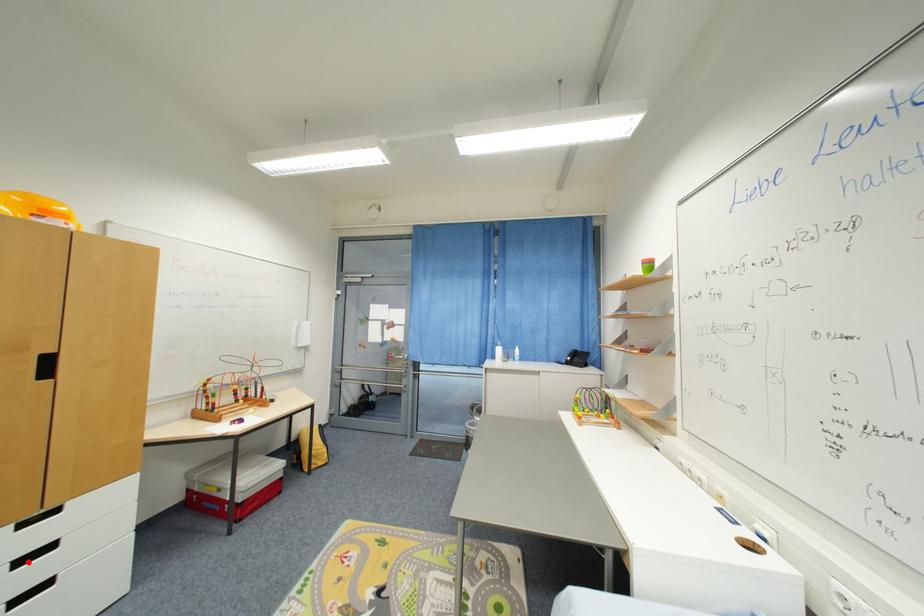
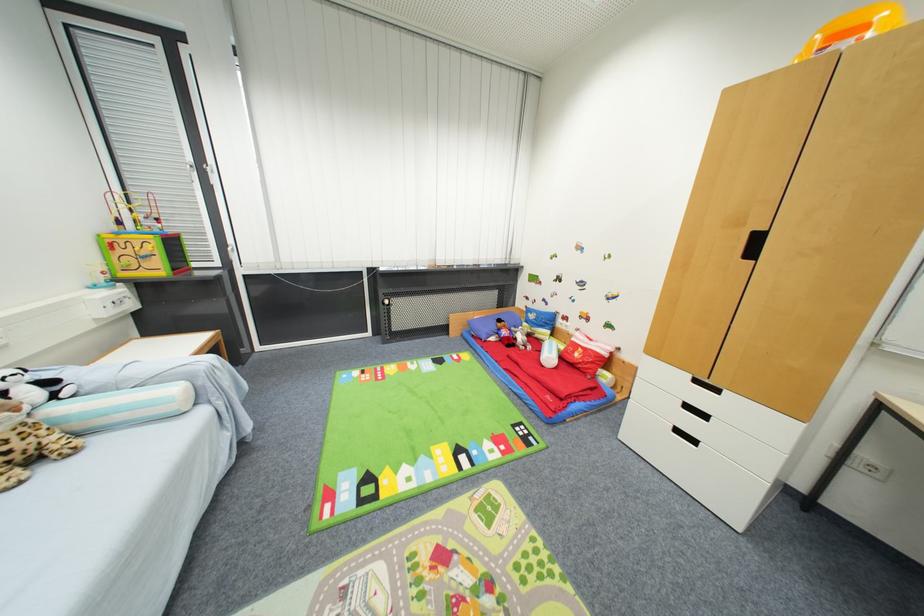
Question: I am providing you with two images of the same scene from different viewpoints. A red point is shown in image1. For the corresponding object point in image2, is it positioned nearer or farther from the camera?

Choices:
 (A) Nearer
 (B) Farther

Answer: (B)